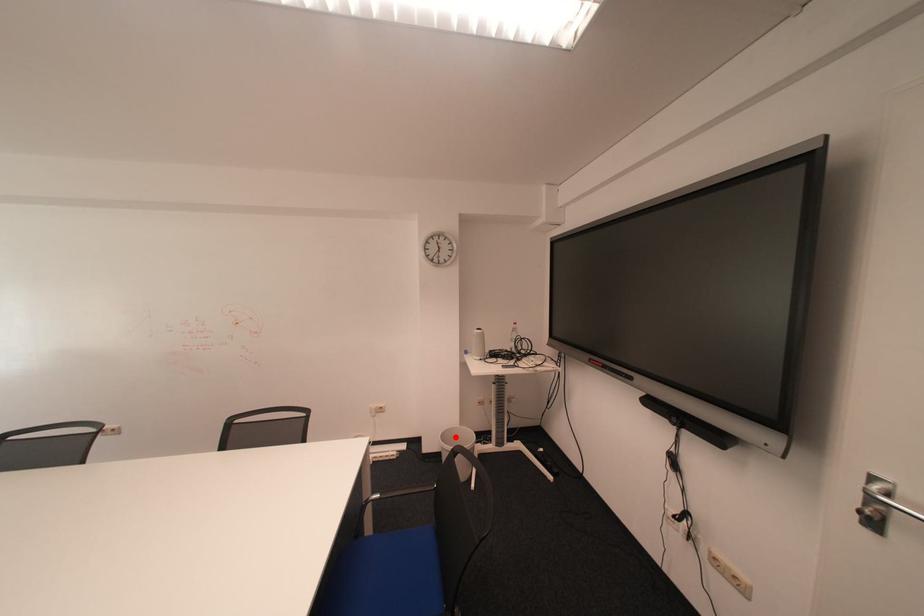
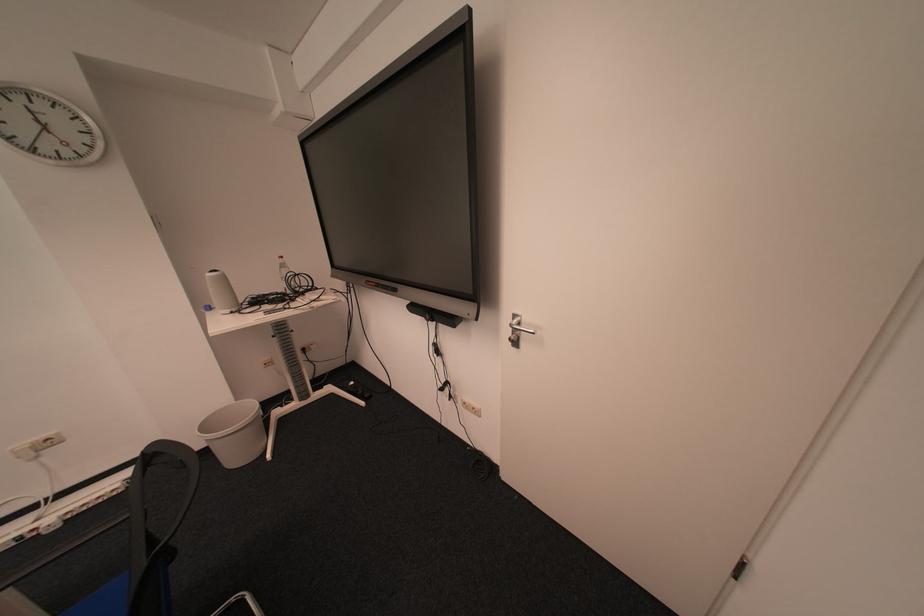
Find the pixel in the second image that matches the highlighted location in the first image.

(216, 426)